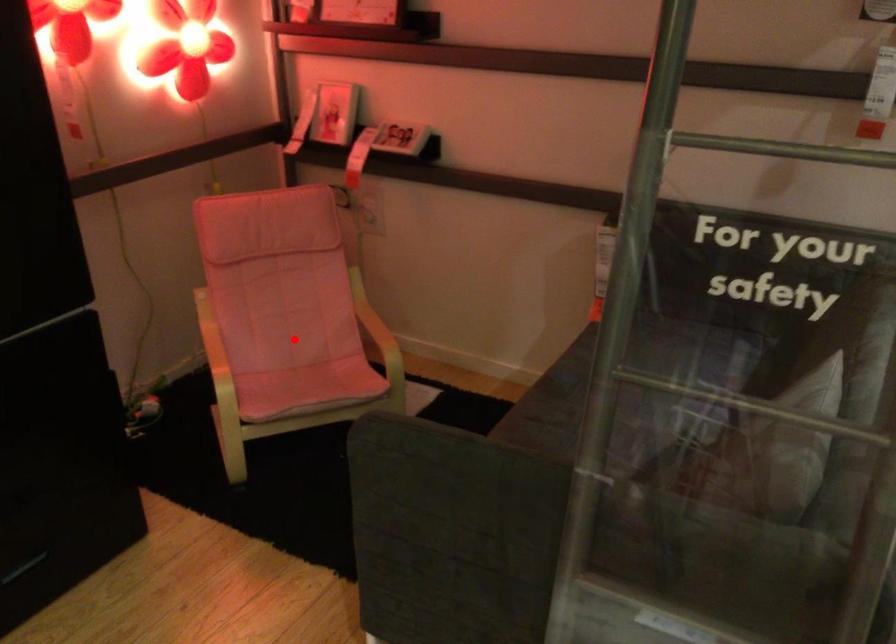
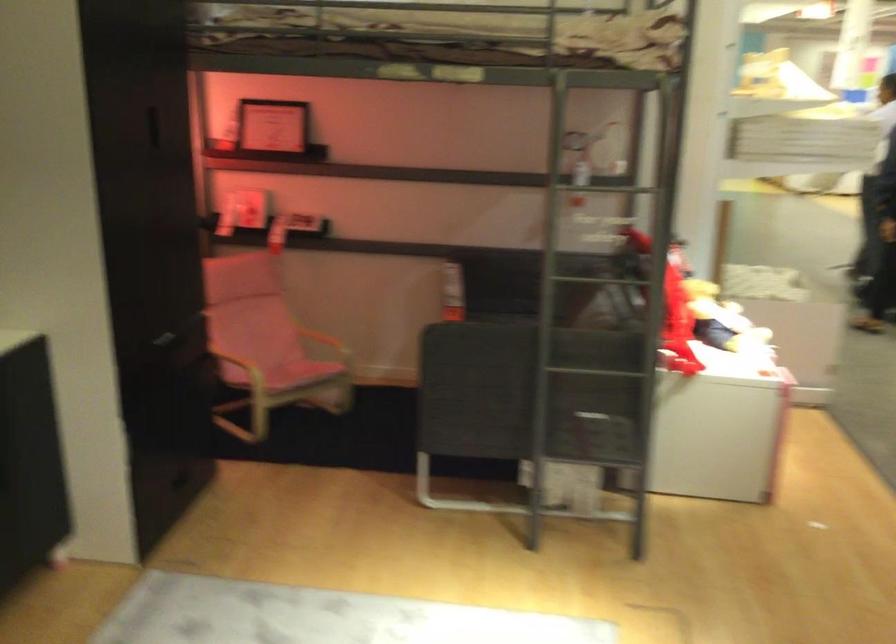
Question: I am providing you with two images of the same scene from different viewpoints. A red point is shown in image1. For the corresponding object point in image2, is it positioned nearer or farther from the camera?

Choices:
 (A) Nearer
 (B) Farther

Answer: (B)